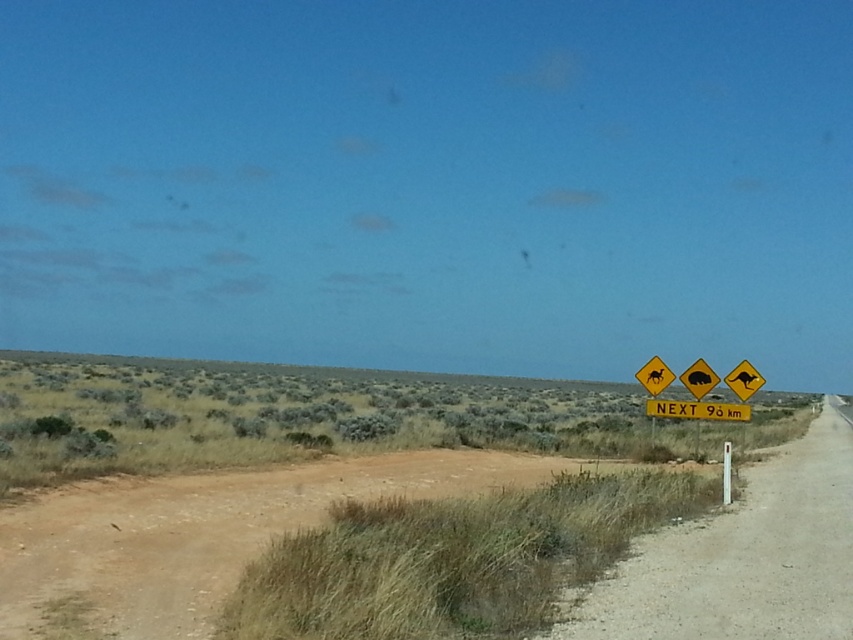
Who is lower down, yellow plastic camel at upper right or white plastic pole at right?

Positioned lower is white plastic pole at right.

Which of these two, yellow plastic camel at upper right or white plastic pole at right, stands shorter?

With less height is yellow plastic camel at upper right.

I want to click on yellow plastic camel at upper right, so click(654, 376).

Does brown dirt track at lower left appear over yellow plastic sign at right?

Yes.

Can you confirm if brown dirt track at lower left is positioned to the left of yellow plastic sign at right?

Indeed, brown dirt track at lower left is positioned on the left side of yellow plastic sign at right.

This screenshot has width=853, height=640. I want to click on brown dirt track at lower left, so pos(202,532).

Between yellow plastic sign at right and white plastic pole at right, which one has more height?

Standing taller between the two is yellow plastic sign at right.

Does point (734, 611) lie in front of point (726, 492)?

Yes, it is in front of point (726, 492).

Based on the photo, who is more distant from viewer, (842, 518) or (728, 448)?

Positioned behind is point (728, 448).

Where is `yellow plastic sign at right`? The image size is (853, 640). yellow plastic sign at right is located at coordinates (743, 557).